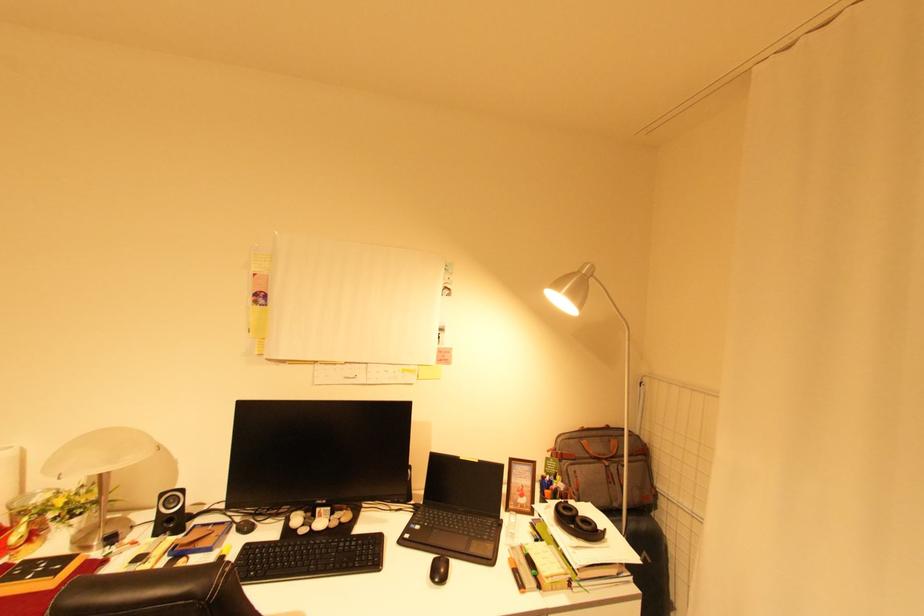
This screenshot has height=616, width=924. What do you see at coordinates (614, 466) in the screenshot?
I see `the brown bag handle` at bounding box center [614, 466].